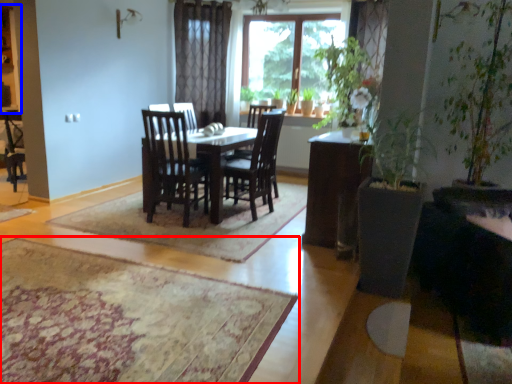
Question: Which of the following is the closest to the observer, mat (highlighted by a red box) or cabinetry (highlighted by a blue box)?

Choices:
 (A) mat
 (B) cabinetry

Answer: (A)